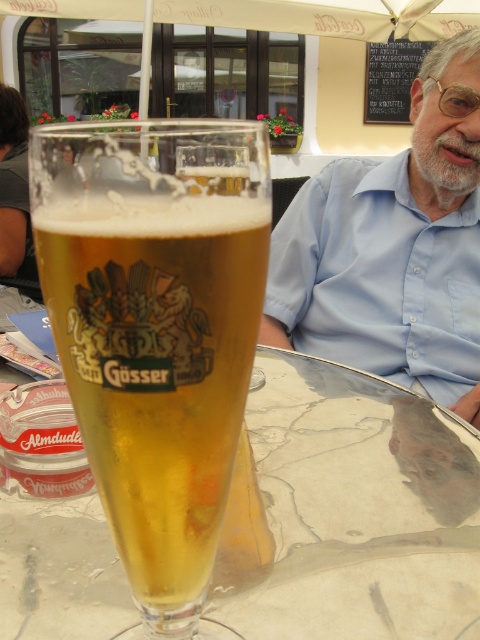
Question: Which is farther from the transparent glass table at center?

Choices:
 (A) blue cotton shirt at upper center
 (B) translucent glass beer at center

Answer: (A)

Question: Does translucent glass beer at center lie behind transparent glass table at center?

Choices:
 (A) yes
 (B) no

Answer: (B)

Question: Which point is closer to the camera?

Choices:
 (A) pos(459,216)
 (B) pos(108,294)
 (C) pos(0,536)

Answer: (B)

Question: Which object appears farthest from the camera in this image?

Choices:
 (A) blue cotton shirt at upper center
 (B) transparent glass table at center

Answer: (A)

Question: Can you confirm if translucent glass beer at center is positioned to the right of transparent glass table at center?

Choices:
 (A) yes
 (B) no

Answer: (B)

Question: Does translucent glass beer at center have a lesser width compared to transparent glass table at center?

Choices:
 (A) yes
 (B) no

Answer: (A)